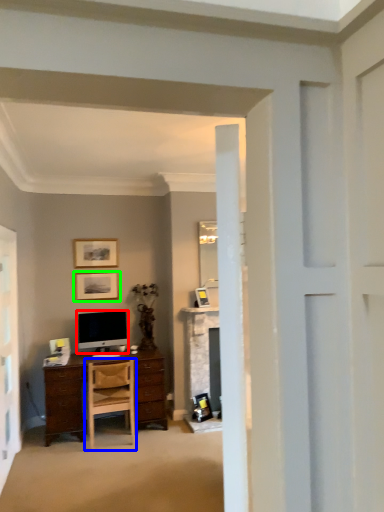
Question: Considering the real-world distances, which object is closest to television (highlighted by a red box)? chair (highlighted by a blue box) or picture frame (highlighted by a green box).

Choices:
 (A) chair
 (B) picture frame

Answer: (B)